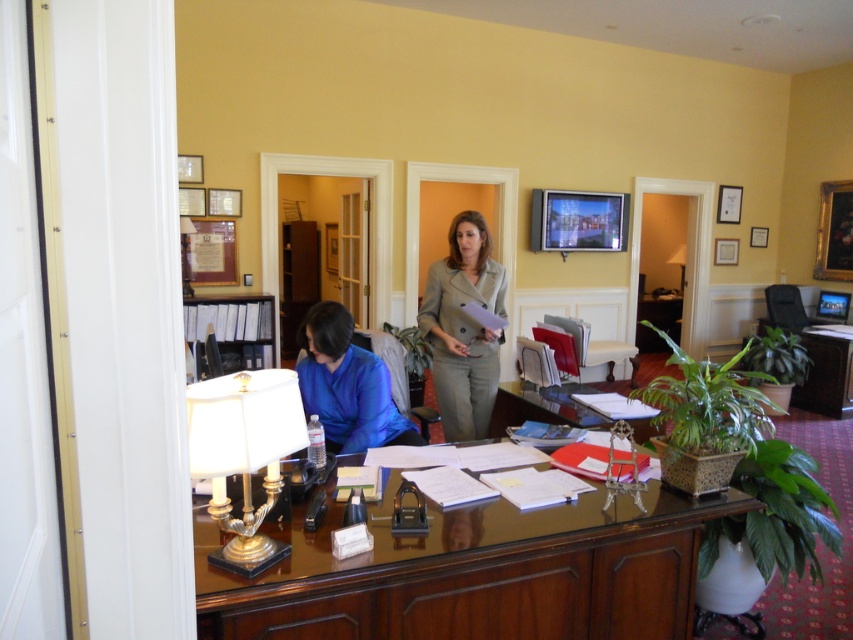
Does glossy wood table at center have a larger size compared to light gray suit at center?

Indeed, glossy wood table at center has a larger size compared to light gray suit at center.

Which of these two, glossy wood table at center or light gray suit at center, stands taller?

light gray suit at center is taller.

Is point (564, 612) closer to viewer compared to point (479, 304)?

Yes.

I want to click on glossy wood table at center, so [474, 572].

Can you confirm if light gray suit at center is thinner than matte white lamp at upper right?

Incorrect, light gray suit at center's width is not less than matte white lamp at upper right's.

Can you confirm if light gray suit at center is bigger than matte white lamp at upper right?

Incorrect, light gray suit at center is not larger than matte white lamp at upper right.

Where is `light gray suit at center`? This screenshot has width=853, height=640. light gray suit at center is located at coordinates (463, 326).

Who is lower down, matte blue blouse at left or matte white lamp at upper right?

matte blue blouse at left

Who is more distant from viewer, (350, 344) or (682, 276)?

Positioned behind is point (682, 276).

Where is `matte blue blouse at left`? The width and height of the screenshot is (853, 640). matte blue blouse at left is located at coordinates (347, 385).